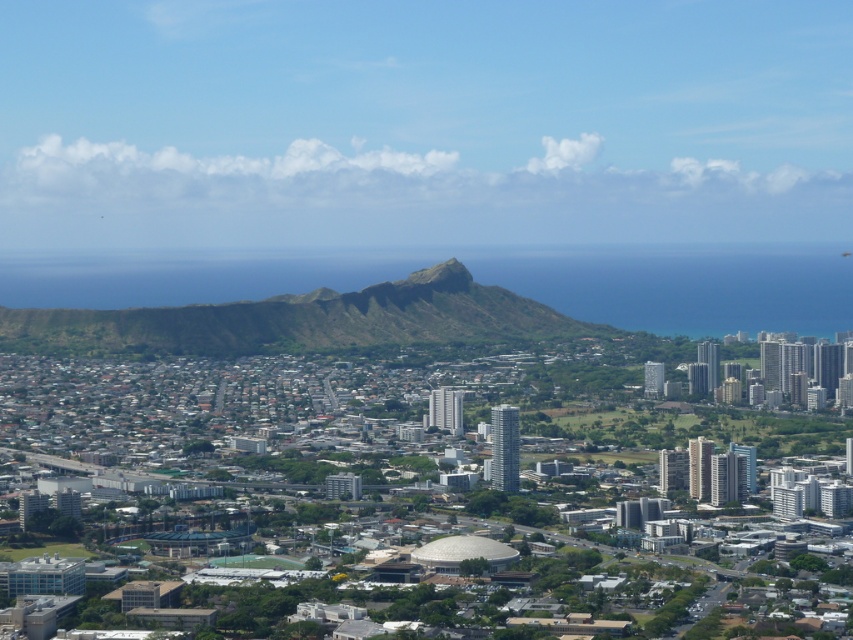
Question: Among these objects, which one is farthest from the camera?

Choices:
 (A) green grassy hill at center
 (B) green grassy peak at center

Answer: (B)

Question: From the image, what is the correct spatial relationship of green grassy hill at center in relation to green grassy peak at center?

Choices:
 (A) right
 (B) left

Answer: (B)

Question: Among these points, which one is nearest to the camera?

Choices:
 (A) (422, 285)
 (B) (408, 342)

Answer: (B)

Question: Is green grassy hill at center above green grassy peak at center?

Choices:
 (A) no
 (B) yes

Answer: (A)

Question: Can you confirm if green grassy hill at center is positioned to the left of green grassy peak at center?

Choices:
 (A) yes
 (B) no

Answer: (A)